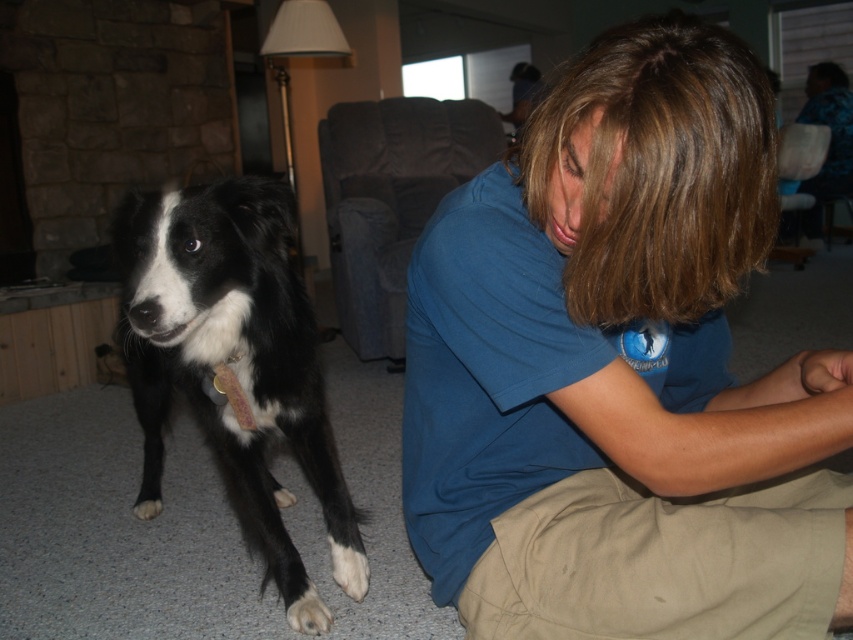
You are standing in the living room where the person and dog are. There is a point at coordinates [621,369]. What object is located at that point?

The blue cotton shirt is located at point [621,369].

In the living room scene, there are two objects with fur mentioned in the image. The black and white fur at left and the white fur at lower left. Which of these two objects has a greater height?

The black and white fur at left is taller than the white fur at lower left.